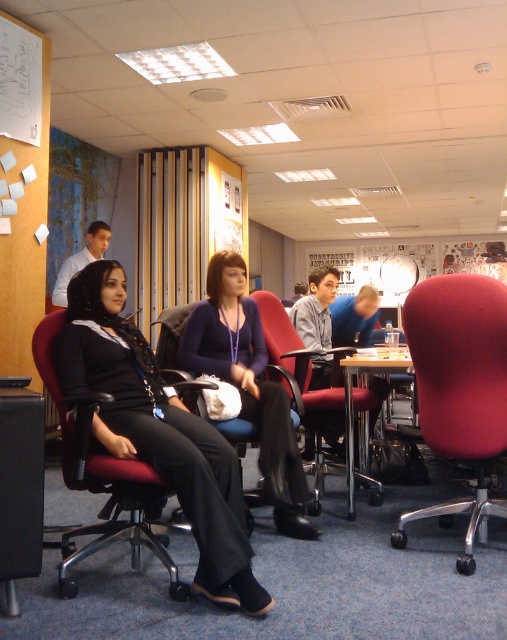
Question: Which object appears closest to the camera in this image?

Choices:
 (A) wooden table at center
 (B) matte black office chair at left
 (C) matte plastic chair at center

Answer: (B)

Question: Observing the image, what is the correct spatial positioning of matte black office chair at left in reference to wooden table at center?

Choices:
 (A) left
 (B) right

Answer: (A)

Question: Based on their relative distances, which object is nearer to the matte black shirt at left?

Choices:
 (A) smooth red swivel chair at right
 (B) matte black office chair at left
 (C) wooden table at center
 (D) matte plastic chair at center

Answer: (D)

Question: From the image, what is the correct spatial relationship of wooden table at center in relation to matte black shirt at left?

Choices:
 (A) right
 (B) left

Answer: (A)

Question: Among these points, which one is nearest to the camera?

Choices:
 (A) (136, 474)
 (B) (485, 305)
 (C) (277, 356)
 (D) (350, 490)

Answer: (A)

Question: Observing the image, what is the correct spatial positioning of matte plastic chair at center in reference to wooden table at center?

Choices:
 (A) below
 (B) above

Answer: (A)